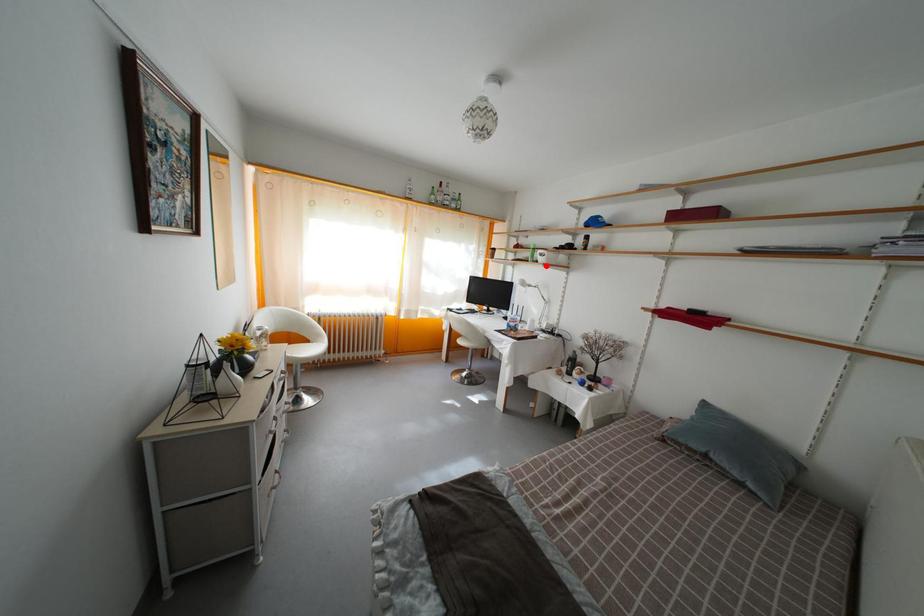
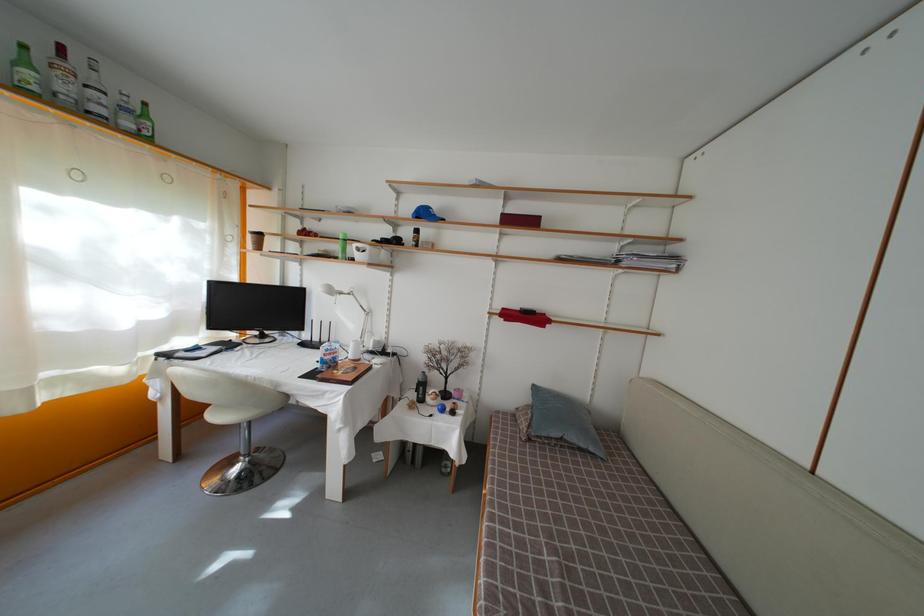
Question: A red point is marked in image1. In image2, is the corresponding 3D point closer to the camera or farther? Reply with the corresponding letter.

Choices:
 (A) The corresponding 3D point is closer.
 (B) The corresponding 3D point is farther.

Answer: (B)